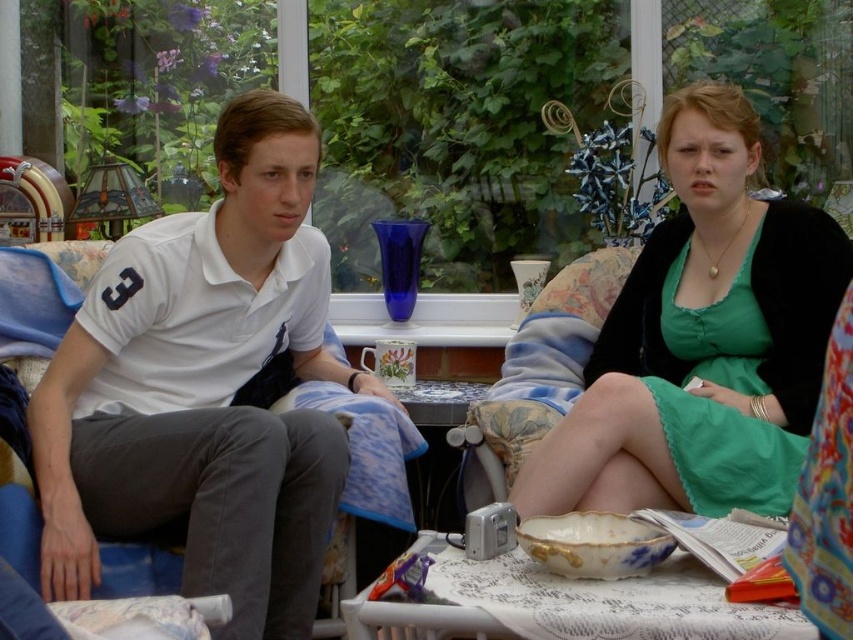
Who is taller, green satin dress at center or porcelain bowl at lower center?

Standing taller between the two is green satin dress at center.

Is green satin dress at center bigger than porcelain bowl at lower center?

Yes, green satin dress at center is bigger than porcelain bowl at lower center.

Who is more distant from viewer, [721,419] or [614,589]?

Positioned behind is point [721,419].

Locate an element on the screen. This screenshot has width=853, height=640. green satin dress at center is located at coordinates (701, 340).

From the picture: Can you confirm if white cotton polo shirt at left is bigger than green satin dress at center?

Indeed, white cotton polo shirt at left has a larger size compared to green satin dress at center.

Between white cotton polo shirt at left and green satin dress at center, which one has more height?

white cotton polo shirt at left is taller.

Between point (291, 144) and point (714, 458), which one is positioned behind?

Point (291, 144)

Locate an element on the screen. The image size is (853, 640). white cotton polo shirt at left is located at coordinates (204, 388).

Between white cotton polo shirt at left and porcelain bowl at lower center, which one appears on the left side from the viewer's perspective?

Positioned to the left is white cotton polo shirt at left.

Is white cotton polo shirt at left smaller than porcelain bowl at lower center?

Actually, white cotton polo shirt at left might be larger than porcelain bowl at lower center.

Measure the distance between white cotton polo shirt at left and camera.

The distance of white cotton polo shirt at left from camera is 6.40 feet.

Locate an element on the screen. The width and height of the screenshot is (853, 640). white cotton polo shirt at left is located at coordinates (204, 388).